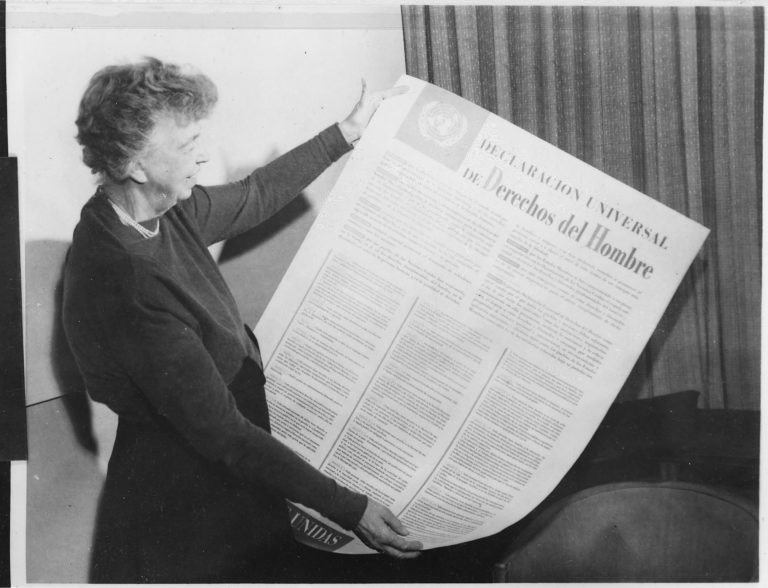
What are the coordinates of `gray curtains` in the screenshot? It's located at (593, 70).